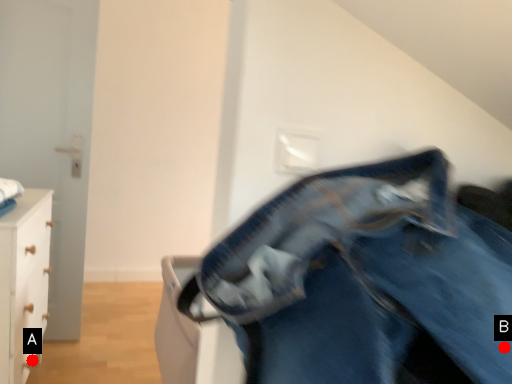
Question: Two points are circled on the image, labeled by A and B beside each circle. Which point is closer to the camera?

Choices:
 (A) A is closer
 (B) B is closer

Answer: (B)